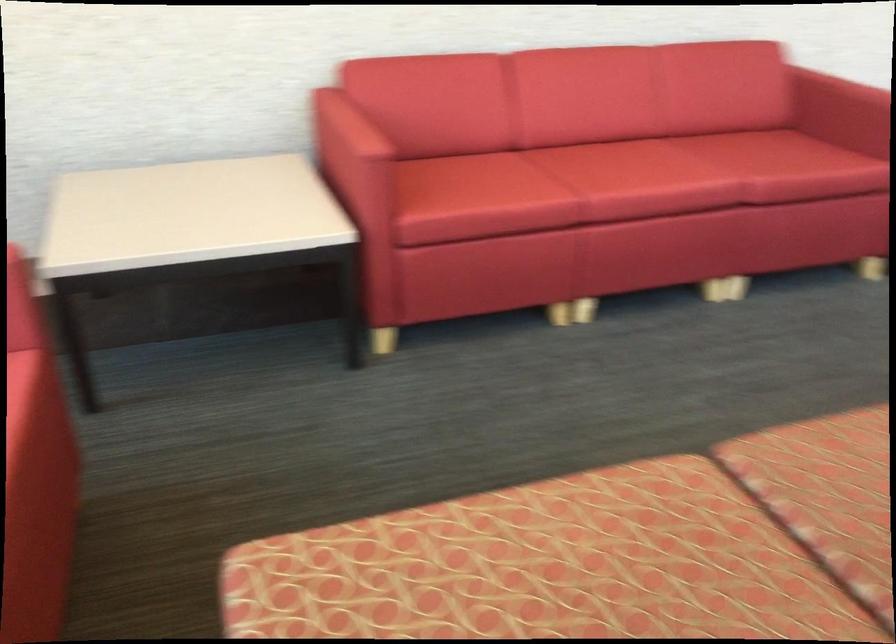
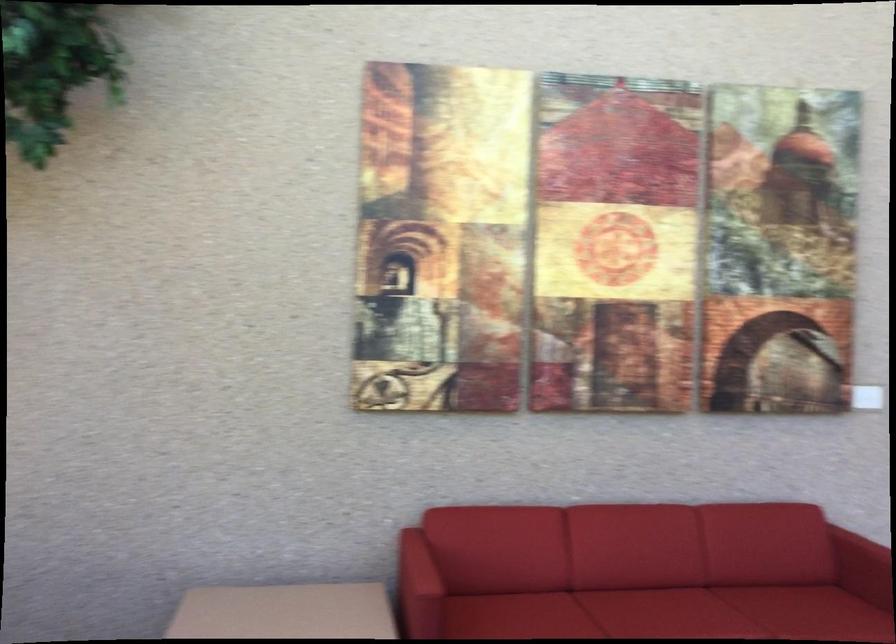
Where in the second image is the point corresponding to the point at 355,120 from the first image?

(418, 564)